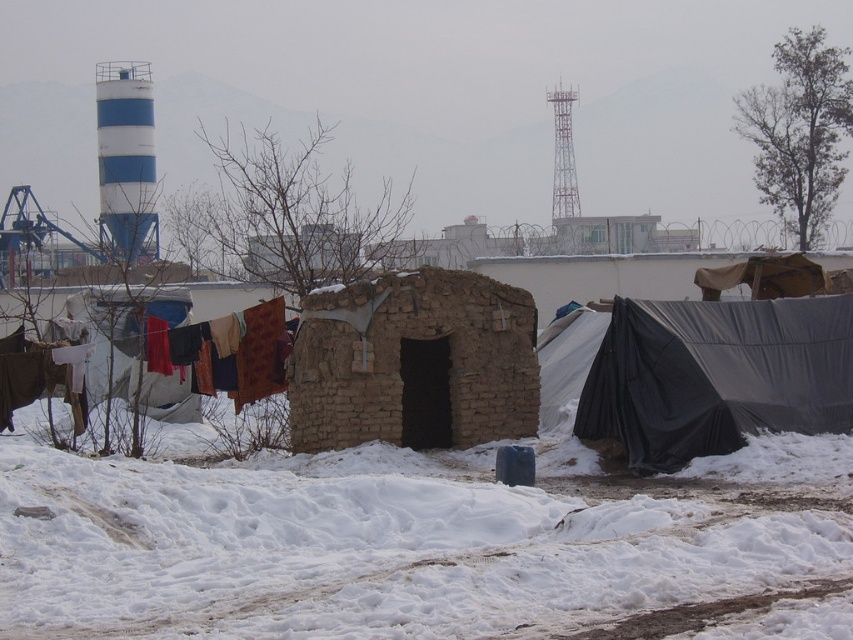
Does white fluffy snow at center appear on the right side of brown mud hut at center?

No, white fluffy snow at center is not to the right of brown mud hut at center.

Does white fluffy snow at center appear under brown mud hut at center?

Yes, white fluffy snow at center is below brown mud hut at center.

Between point (521, 522) and point (489, 429), which one is positioned behind?

Positioned behind is point (489, 429).

Locate an element on the screen. This screenshot has height=640, width=853. white fluffy snow at center is located at coordinates (366, 550).

Does white fluffy snow at center appear on the right side of black tarpaulin tent at right?

Incorrect, white fluffy snow at center is not on the right side of black tarpaulin tent at right.

Between white fluffy snow at center and black tarpaulin tent at right, which one appears on the left side from the viewer's perspective?

From the viewer's perspective, white fluffy snow at center appears more on the left side.

Which is in front, point (347, 460) or point (737, 358)?

Point (737, 358) is in front.

At what (x,y) coordinates should I click in order to perform the action: click on white fluffy snow at center. Please return your answer as a coordinate pair (x, y). Looking at the image, I should click on (366, 550).

Is black tarpaulin tent at right bigger than multicolored fabric at left?

No.

Who is taller, black tarpaulin tent at right or multicolored fabric at left?

multicolored fabric at left is taller.

Between point (793, 305) and point (270, 349), which one is positioned behind?

Point (270, 349)

Locate an element on the screen. Image resolution: width=853 pixels, height=640 pixels. black tarpaulin tent at right is located at coordinates (717, 376).